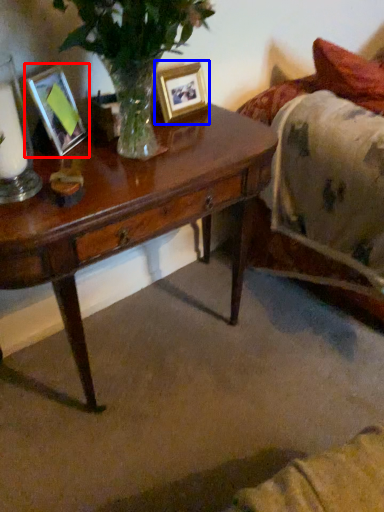
Question: Which object appears farthest to the camera in this image, picture frame (highlighted by a red box) or picture frame (highlighted by a blue box)?

Choices:
 (A) picture frame
 (B) picture frame

Answer: (B)